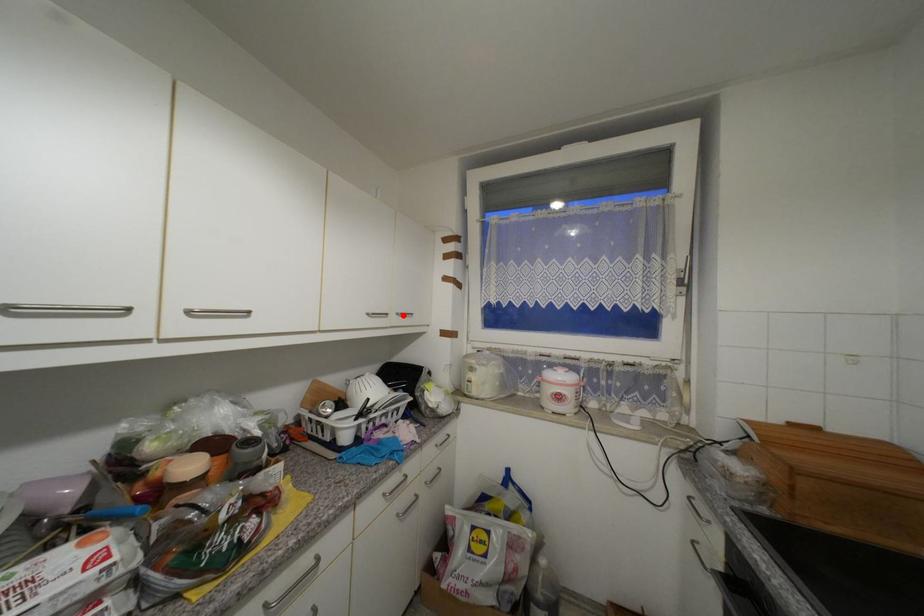
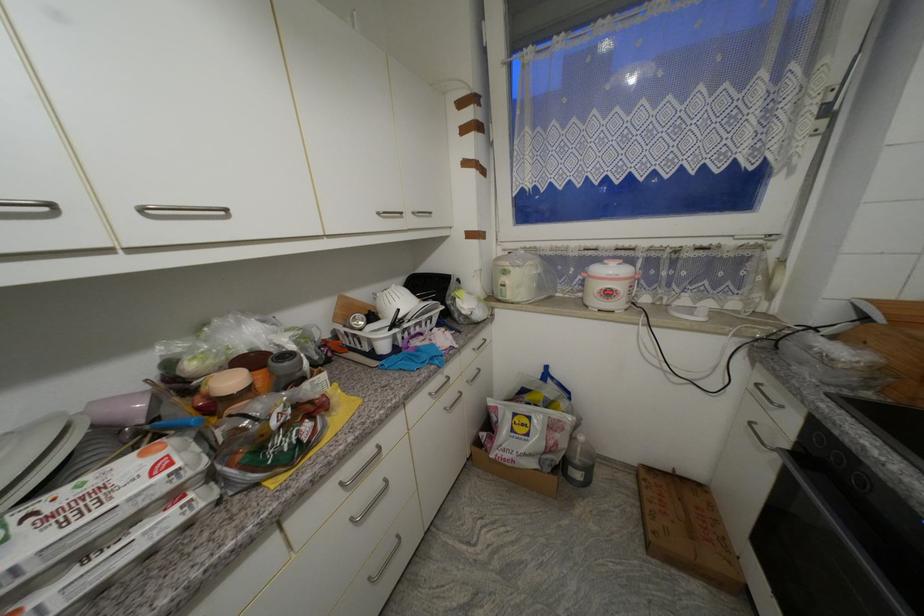
Find the pixel in the second image that matches the highlighted location in the first image.

(419, 215)